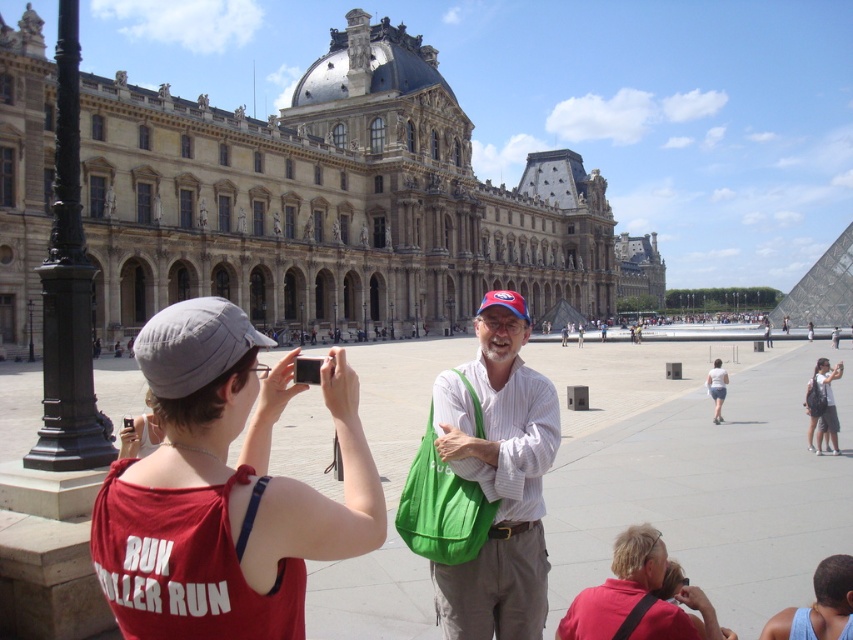
Question: Observing the image, what is the correct spatial positioning of red fabric shirt at lower right in reference to white cotton shorts at lower right?

Choices:
 (A) above
 (B) below

Answer: (B)

Question: Which object appears farthest from the camera in this image?

Choices:
 (A) white cotton shorts at lower right
 (B) red cotton tank top at center
 (C) red fabric shirt at lower right

Answer: (A)

Question: Which object appears farthest from the camera in this image?

Choices:
 (A) blue tank top at lower right
 (B) white backpack at center
 (C) red fabric shirt at lower right
 (D) red cotton tank top at center

Answer: (B)

Question: Can you confirm if red cotton tank top at center is bigger than red fabric shirt at lower right?

Choices:
 (A) yes
 (B) no

Answer: (A)

Question: Does matte white shirt at center appear on the left side of red fabric shirt at lower right?

Choices:
 (A) yes
 (B) no

Answer: (A)

Question: Which point is farther to the camera?

Choices:
 (A) matte white shirt at center
 (B) red fabric shirt at lower right
 (C) white cotton shorts at lower right

Answer: (C)